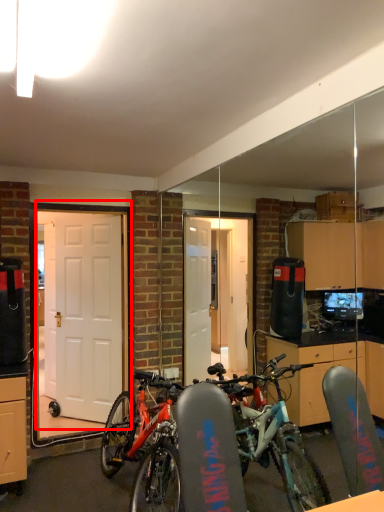
Question: Considering the relative positions of door (annotated by the red box) and door in the image provided, where is door (annotated by the red box) located with respect to the staircase?

Choices:
 (A) right
 (B) left

Answer: (A)